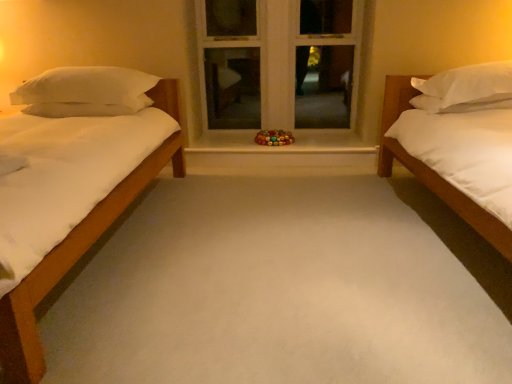
Question: Do you think white marble window sill at center is within white soft pillow at left, which ranks as the 2th pillow in right-to-left order, or outside of it?

Choices:
 (A) inside
 (B) outside

Answer: (B)

Question: From a real-world perspective, is white marble window sill at center physically located above or below white soft pillow at left, which ranks as the 2th pillow in right-to-left order?

Choices:
 (A) above
 (B) below

Answer: (B)

Question: Which object is the closest to the white soft pillow at left, arranged as the 1th pillow when viewed from the left?

Choices:
 (A) white matte bed at right
 (B) white marble window sill at center
 (C) white painted wood at center
 (D) white soft pillow at right, arranged as the second pillow when viewed from the left

Answer: (B)

Question: Estimate the real-world distances between objects in this image. Which object is closer to the white marble window sill at center?

Choices:
 (A) white painted wood at center
 (B) white soft pillow at left, which ranks as the 2th pillow in right-to-left order
 (C) white matte bed at right
 (D) white soft pillow at right, arranged as the second pillow when viewed from the left

Answer: (A)